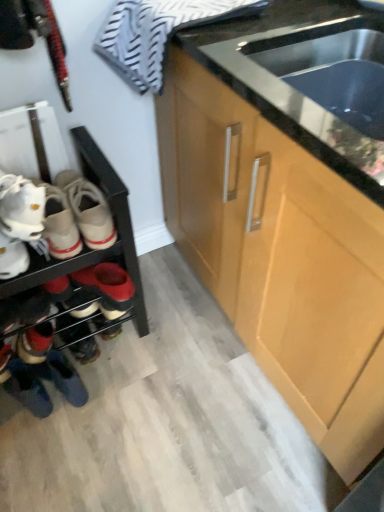
Identify the location of free space in front of black matte shoe rack at left. coord(89,440).